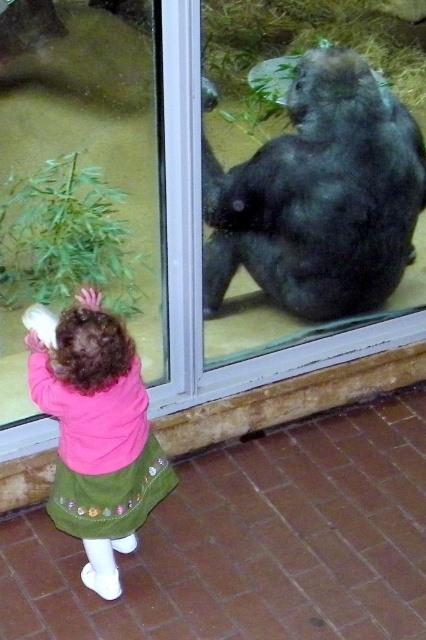
Who is taller, dark gray fur at center or pink fleece jacket at lower left?

dark gray fur at center

Between point (216, 305) and point (60, 509), which one is positioned in front?

Positioned in front is point (60, 509).

Between point (339, 192) and point (120, 372), which one is positioned behind?

Positioned behind is point (339, 192).

At what (x,y) coordinates should I click in order to perform the action: click on dark gray fur at center. Please return your answer as a coordinate pair (x, y). The height and width of the screenshot is (640, 426). Looking at the image, I should click on (321, 196).

Can you confirm if pink fleece jacket at lower left is positioned to the left of transparent glass door at upper center?

Correct, you'll find pink fleece jacket at lower left to the left of transparent glass door at upper center.

The height and width of the screenshot is (640, 426). What do you see at coordinates (97, 435) in the screenshot?
I see `pink fleece jacket at lower left` at bounding box center [97, 435].

Which is behind, point (140, 445) or point (6, 445)?

The point (6, 445) is behind.

You are a GUI agent. You are given a task and a screenshot of the screen. Output one action in this format:
    pyautogui.click(x=<x>, y=<y>)
    Task: Click on the pink fleece jacket at lower left
    
    Given the screenshot: What is the action you would take?
    pyautogui.click(x=97, y=435)

Who is higher up, dark gray fur at center or transparent glass door at upper center?

dark gray fur at center is higher up.

Who is shorter, dark gray fur at center or transparent glass door at upper center?

With less height is dark gray fur at center.

Is point (290, 179) closer to viewer compared to point (190, 17)?

No.

You are a GUI agent. You are given a task and a screenshot of the screen. Output one action in this format:
    pyautogui.click(x=<x>, y=<y>)
    Task: Click on the dark gray fur at center
    
    Given the screenshot: What is the action you would take?
    pyautogui.click(x=321, y=196)